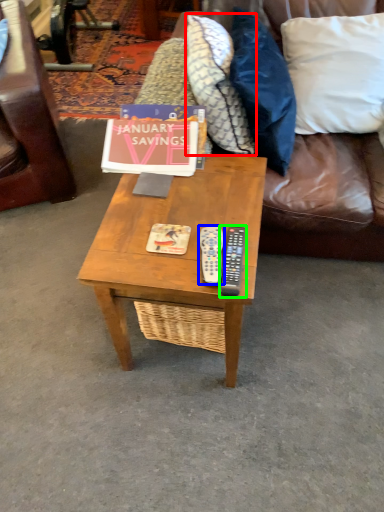
Question: Which object is positioned closest to pillow (highlighted by a red box)? Select from remote (highlighted by a blue box) and remote (highlighted by a green box).

Choices:
 (A) remote
 (B) remote

Answer: (B)